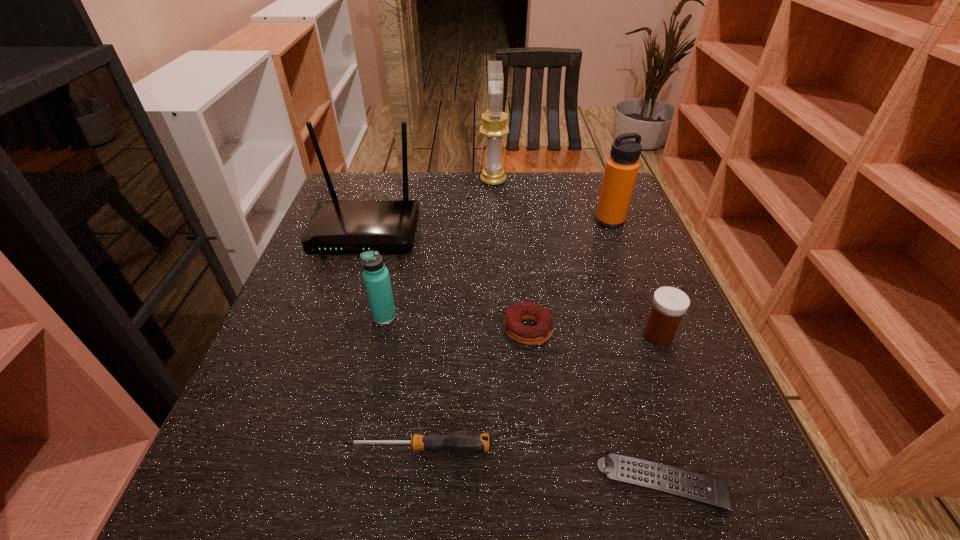
Locate an element on the screen. Image resolution: width=960 pixels, height=540 pixels. the farthest object is located at coordinates (494, 127).

Find the location of a particular element. The width and height of the screenshot is (960, 540). the tallest object is located at coordinates (494, 127).

Find the location of a particular element. The height and width of the screenshot is (540, 960). router is located at coordinates (337, 227).

You are a GUI agent. You are given a task and a screenshot of the screen. Output one action in this format:
    pyautogui.click(x=<x>, y=<y>)
    Task: Click on the farther thermos bottle
    The image size is (960, 540).
    Given the screenshot: What is the action you would take?
    click(621, 169)

Locate an element on the screen. the taller thermos bottle is located at coordinates (621, 169).

At what (x,y) coordinates should I click in order to perform the action: click on the nearer thermos bottle. Please return your answer as a coordinate pair (x, y). The width and height of the screenshot is (960, 540). Looking at the image, I should click on (376, 278).

This screenshot has width=960, height=540. Identify the location of the left thermos bottle. (376, 278).

Find the location of a particular element. The width and height of the screenshot is (960, 540). the fourth shortest object is located at coordinates (669, 304).

Image resolution: width=960 pixels, height=540 pixels. In order to click on doughnut in this screenshot , I will do `click(530, 335)`.

At what (x,y) coordinates should I click in order to perform the action: click on screwdriver. Please return your answer as a coordinate pair (x, y). The width and height of the screenshot is (960, 540). Looking at the image, I should click on (465, 442).